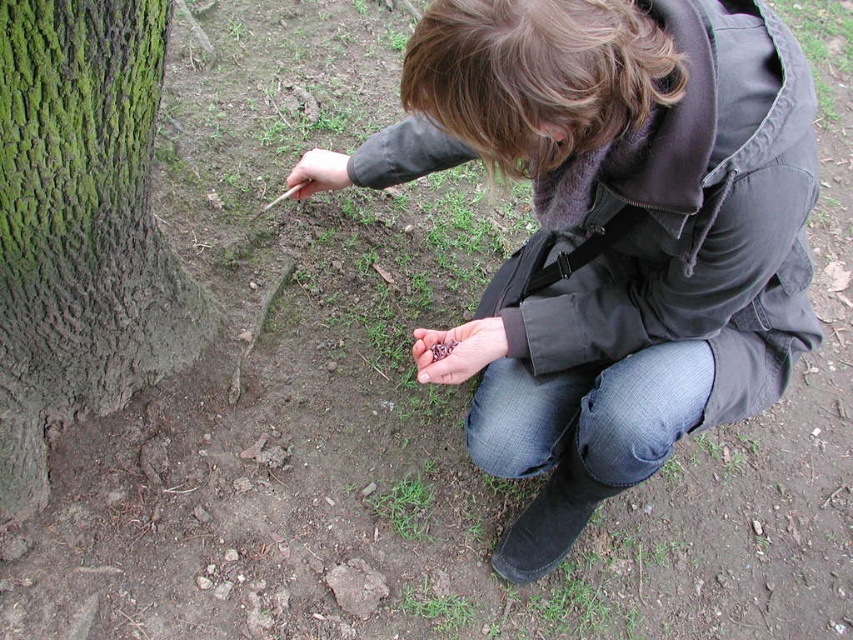
This screenshot has width=853, height=640. Describe the element at coordinates (618, 228) in the screenshot. I see `matte black jacket at center` at that location.

Does point (582, 164) come in front of point (115, 310)?

Yes, point (582, 164) is in front of point (115, 310).

The image size is (853, 640). What do you see at coordinates (618, 228) in the screenshot?
I see `matte black jacket at center` at bounding box center [618, 228].

Find the location of a particular element. matte black jacket at center is located at coordinates (618, 228).

Looking at this image, which is more to the right, purple matte berries at center or matte brown stick at center?

purple matte berries at center is more to the right.

Is the position of purple matte berries at center less distant than that of matte brown stick at center?

Yes, purple matte berries at center is in front of matte brown stick at center.

Is point (440, 364) closer to camera compared to point (299, 195)?

Yes.

Locate an element on the screen. purple matte berries at center is located at coordinates (457, 349).

Is green rough bark at lower left closer to camera compared to matte brown stick at center?

Yes, it is in front of matte brown stick at center.

Between point (183, 348) and point (316, 168), which one is positioned behind?

The point (183, 348) is behind.

What do you see at coordinates (80, 227) in the screenshot? Image resolution: width=853 pixels, height=640 pixels. I see `green rough bark at lower left` at bounding box center [80, 227].

The image size is (853, 640). I want to click on green rough bark at lower left, so click(x=80, y=227).